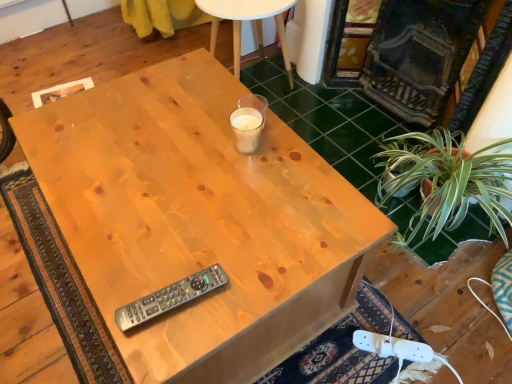
Question: From a real-world perspective, is translucent glass candle at center, the 2th coffee cup when ordered from top to bottom, over white paper cup at center, positioned as the first coffee cup in top-to-bottom order?

Choices:
 (A) no
 (B) yes

Answer: (B)

Question: From the image's perspective, is translucent glass candle at center, the 2th coffee cup when ordered from top to bottom, on top of white paper cup at center, positioned as the first coffee cup in top-to-bottom order?

Choices:
 (A) yes
 (B) no

Answer: (B)

Question: Does translucent glass candle at center, the 2th coffee cup when ordered from top to bottom, have a greater height compared to white paper cup at center, positioned as the first coffee cup in top-to-bottom order?

Choices:
 (A) no
 (B) yes

Answer: (B)

Question: Is translucent glass candle at center, the 2th coffee cup when ordered from top to bottom, thinner than white paper cup at center, the 2th coffee cup in the bottom-to-top sequence?

Choices:
 (A) yes
 (B) no

Answer: (B)

Question: Can white paper cup at center, the 2th coffee cup in the bottom-to-top sequence, be found inside translucent glass candle at center, the 2th coffee cup when ordered from top to bottom?

Choices:
 (A) yes
 (B) no

Answer: (B)

Question: Looking at the image, does natural wood desk at center seem bigger or smaller compared to white paper cup at center, positioned as the first coffee cup in top-to-bottom order?

Choices:
 (A) small
 (B) big

Answer: (B)

Question: Relative to white paper cup at center, the 2th coffee cup in the bottom-to-top sequence, is natural wood desk at center in front or behind?

Choices:
 (A) behind
 (B) front

Answer: (B)

Question: From a real-world perspective, is natural wood desk at center physically located above or below white paper cup at center, positioned as the first coffee cup in top-to-bottom order?

Choices:
 (A) above
 (B) below

Answer: (B)

Question: Is natural wood desk at center to the left or to the right of white paper cup at center, positioned as the first coffee cup in top-to-bottom order, in the image?

Choices:
 (A) left
 (B) right

Answer: (A)

Question: Is natural wood desk at center taller or shorter than translucent glass candle at center, marked as the first coffee cup in a bottom-to-top arrangement?

Choices:
 (A) short
 (B) tall

Answer: (B)

Question: Choose the correct answer: Is natural wood desk at center inside translucent glass candle at center, the 2th coffee cup when ordered from top to bottom, or outside it?

Choices:
 (A) outside
 (B) inside

Answer: (A)

Question: From a real-world perspective, is natural wood desk at center above or below translucent glass candle at center, marked as the first coffee cup in a bottom-to-top arrangement?

Choices:
 (A) above
 (B) below

Answer: (B)

Question: Considering their positions, is natural wood desk at center located in front of or behind translucent glass candle at center, the 2th coffee cup when ordered from top to bottom?

Choices:
 (A) front
 (B) behind

Answer: (A)

Question: Considering the positions of white paper cup at center, positioned as the first coffee cup in top-to-bottom order, and translucent glass candle at center, the 2th coffee cup when ordered from top to bottom, in the image, is white paper cup at center, positioned as the first coffee cup in top-to-bottom order, taller or shorter than translucent glass candle at center, the 2th coffee cup when ordered from top to bottom,?

Choices:
 (A) short
 (B) tall

Answer: (A)

Question: Visually, is white paper cup at center, the 2th coffee cup in the bottom-to-top sequence, positioned to the left or to the right of translucent glass candle at center, the 2th coffee cup when ordered from top to bottom?

Choices:
 (A) left
 (B) right

Answer: (B)